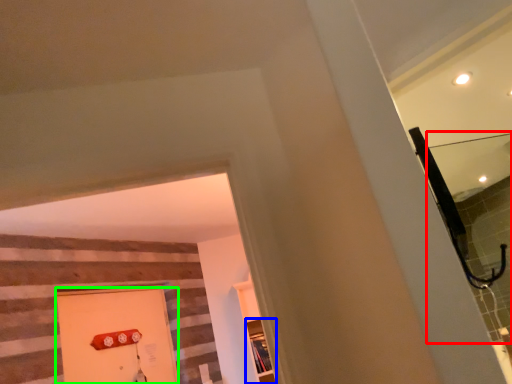
Question: Which is farther away from mirror (highlighted by a red box)? shelf (highlighted by a blue box) or door (highlighted by a green box)?

Choices:
 (A) shelf
 (B) door

Answer: (B)